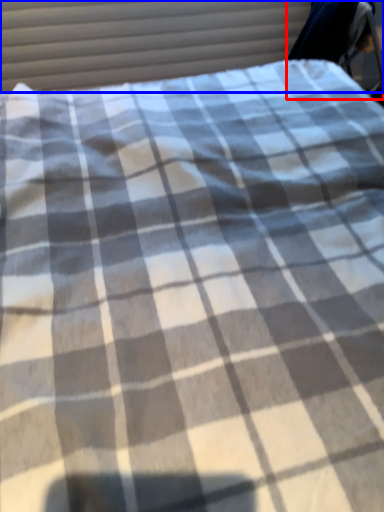
Question: Which object is further to the camera taking this photo, swivel chair (highlighted by a red box) or curtain (highlighted by a blue box)?

Choices:
 (A) swivel chair
 (B) curtain

Answer: (B)